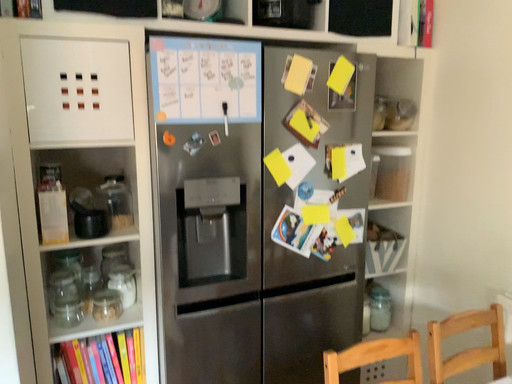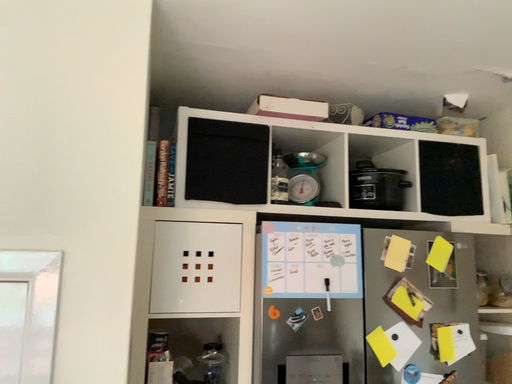
Question: Which way did the camera rotate in the video?

Choices:
 (A) rotated downward
 (B) rotated upward

Answer: (B)